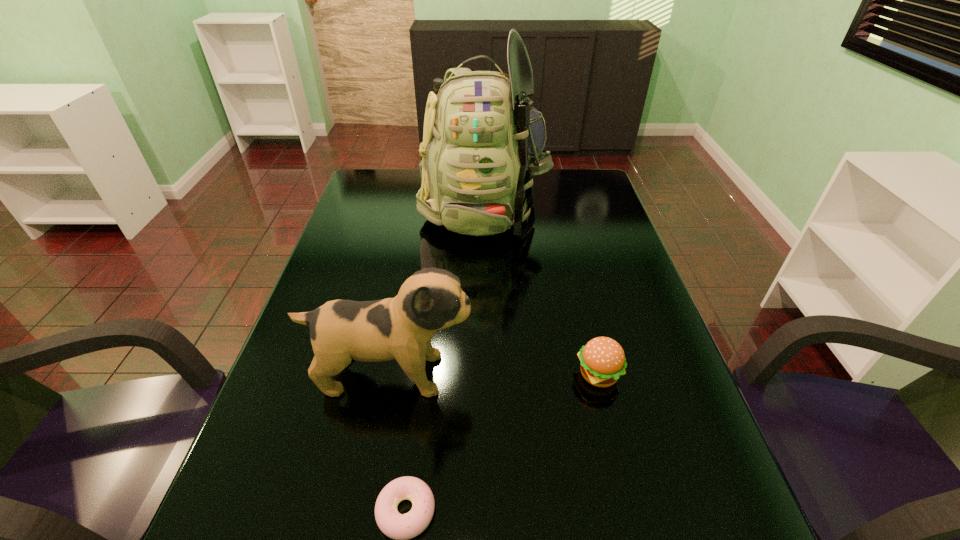
At what (x,y) coordinates should I click in order to perform the action: click on the tallest object. Please return your answer as a coordinate pair (x, y). Looking at the image, I should click on (482, 142).

You are a GUI agent. You are given a task and a screenshot of the screen. Output one action in this format:
    pyautogui.click(x=<x>, y=<y>)
    Task: Click on the backpack
    The width and height of the screenshot is (960, 540).
    Given the screenshot: What is the action you would take?
    pyautogui.click(x=482, y=142)

This screenshot has height=540, width=960. Identify the location of puppy. (401, 328).

Find the location of a particular element. The height and width of the screenshot is (540, 960). the second shortest object is located at coordinates (603, 361).

At what (x,y) coordinates should I click in order to perform the action: click on vacant space located 0.090m on the front-facing side of the farthest object. Please return your answer as a coordinate pair (x, y). Looking at the image, I should click on (483, 273).

You are a GUI agent. You are given a task and a screenshot of the screen. Output one action in this format:
    pyautogui.click(x=<x>, y=<y>)
    Task: Click on the vacant area situated at the face of the third shortest object
    This screenshot has height=540, width=960.
    Given the screenshot: What is the action you would take?
    pyautogui.click(x=591, y=374)

Find the location of a particular element. vacant space located 0.230m on the front of the hamburger is located at coordinates (632, 510).

You are a GUI agent. You are given a task and a screenshot of the screen. Output one action in this format:
    pyautogui.click(x=<x>, y=<y>)
    Task: Click on the object that is at the far edge
    
    Given the screenshot: What is the action you would take?
    pyautogui.click(x=482, y=142)

I want to click on object present at the left edge, so click(401, 328).

Locate an element on the screen. The height and width of the screenshot is (540, 960). object positioned at the right edge is located at coordinates (603, 361).